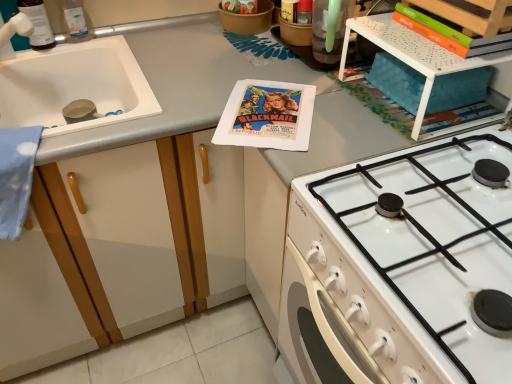
Question: Is orange matte book at upper right bigger than clear plastic bottle at upper left, the 2th bottle from the left?

Choices:
 (A) yes
 (B) no

Answer: (A)

Question: Are orange matte book at upper right and clear plastic bottle at upper left, the 2th bottle from the left, located far from each other?

Choices:
 (A) no
 (B) yes

Answer: (A)

Question: Can you confirm if orange matte book at upper right is taller than clear plastic bottle at upper left, the 2th bottle from the left?

Choices:
 (A) no
 (B) yes

Answer: (A)

Question: Is orange matte book at upper right positioned beyond the bounds of clear plastic bottle at upper left, the 2th bottle from the left?

Choices:
 (A) no
 (B) yes

Answer: (B)

Question: Can you confirm if orange matte book at upper right is smaller than clear plastic bottle at upper left, which is counted as the 1th bottle, starting from the right?

Choices:
 (A) no
 (B) yes

Answer: (A)

Question: Considering the relative sizes of orange matte book at upper right and clear plastic bottle at upper left, which is counted as the 1th bottle, starting from the right, in the image provided, is orange matte book at upper right wider than clear plastic bottle at upper left, which is counted as the 1th bottle, starting from the right,?

Choices:
 (A) no
 (B) yes

Answer: (B)

Question: Can you confirm if white perforated plastic shelf at upper right is thinner than orange matte book at upper right?

Choices:
 (A) yes
 (B) no

Answer: (B)

Question: From the image's perspective, is white perforated plastic shelf at upper right on orange matte book at upper right?

Choices:
 (A) yes
 (B) no

Answer: (B)

Question: Is white perforated plastic shelf at upper right beside orange matte book at upper right?

Choices:
 (A) no
 (B) yes

Answer: (B)

Question: Does white perforated plastic shelf at upper right have a lesser height compared to orange matte book at upper right?

Choices:
 (A) yes
 (B) no

Answer: (B)

Question: Does white perforated plastic shelf at upper right have a larger size compared to orange matte book at upper right?

Choices:
 (A) yes
 (B) no

Answer: (A)

Question: Does white perforated plastic shelf at upper right have a smaller size compared to orange matte book at upper right?

Choices:
 (A) yes
 (B) no

Answer: (B)

Question: Can you confirm if white matte sink at left is smaller than translucent plastic bottle at upper left, which is the first bottle from left to right?

Choices:
 (A) no
 (B) yes

Answer: (A)